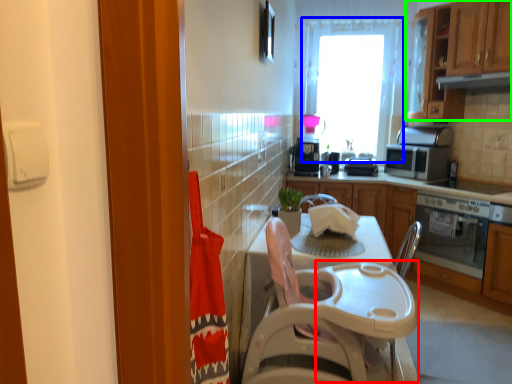
Question: Based on their relative distances, which object is nearer to table (highlighted by a red box)? Choose from window (highlighted by a blue box) and cabinetry (highlighted by a green box).

Choices:
 (A) window
 (B) cabinetry

Answer: (B)